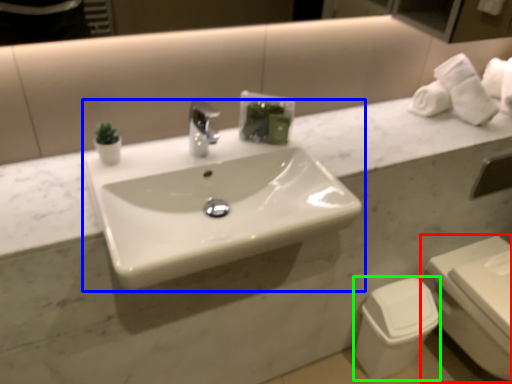
Question: Which object is positioned farthest from toilet (highlighted by a red box)? Select from sink (highlighted by a blue box) and toilet bowl (highlighted by a green box).

Choices:
 (A) sink
 (B) toilet bowl

Answer: (A)